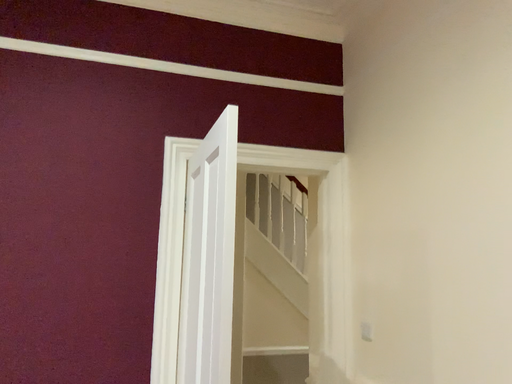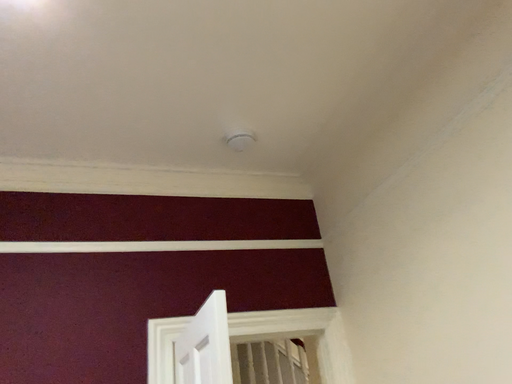
Question: Which way did the camera rotate in the video?

Choices:
 (A) rotated downward
 (B) rotated upward

Answer: (B)